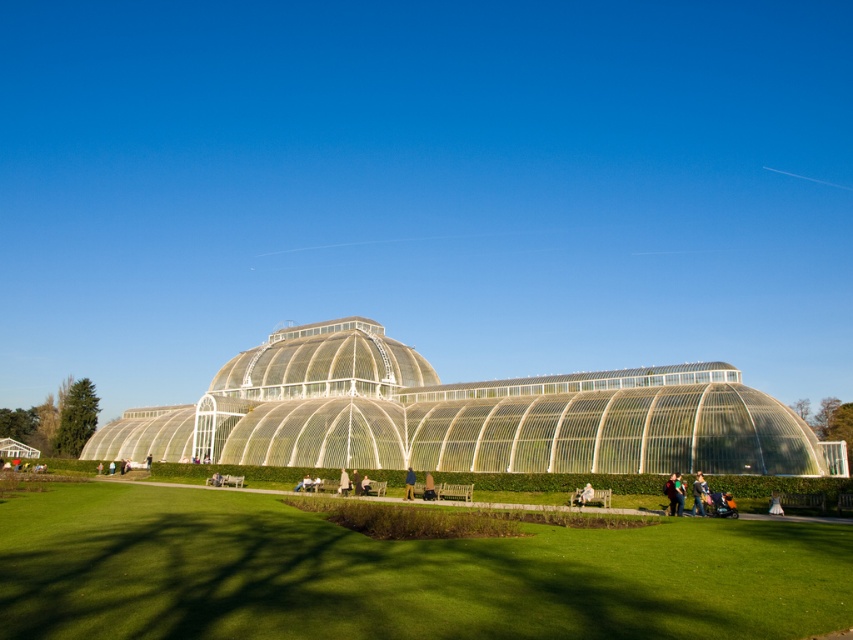
Question: Which object is closer to the camera taking this photo?

Choices:
 (A) blue denim dress at lower right
 (B) green grass at lower center
 (C) dark blue jacket at center
 (D) transparent glass conservatory at center

Answer: (B)

Question: Which point appears farthest from the camera in this image?

Choices:
 (A) (341, 490)
 (B) (734, 547)
 (C) (669, 477)
 (D) (268, 387)

Answer: (D)

Question: Does dark blue jacket at center come in front of brown leather jacket at center?

Choices:
 (A) yes
 (B) no

Answer: (A)

Question: Is green grass at lower center above blue denim dress at lower right?

Choices:
 (A) no
 (B) yes

Answer: (A)

Question: Among these objects, which one is farthest from the camera?

Choices:
 (A) dark blue jacket at center
 (B) blue denim dress at lower right
 (C) green grass at lower center

Answer: (A)

Question: Is dark blue jacket at center to the right of blue denim dress at lower right from the viewer's perspective?

Choices:
 (A) no
 (B) yes

Answer: (A)